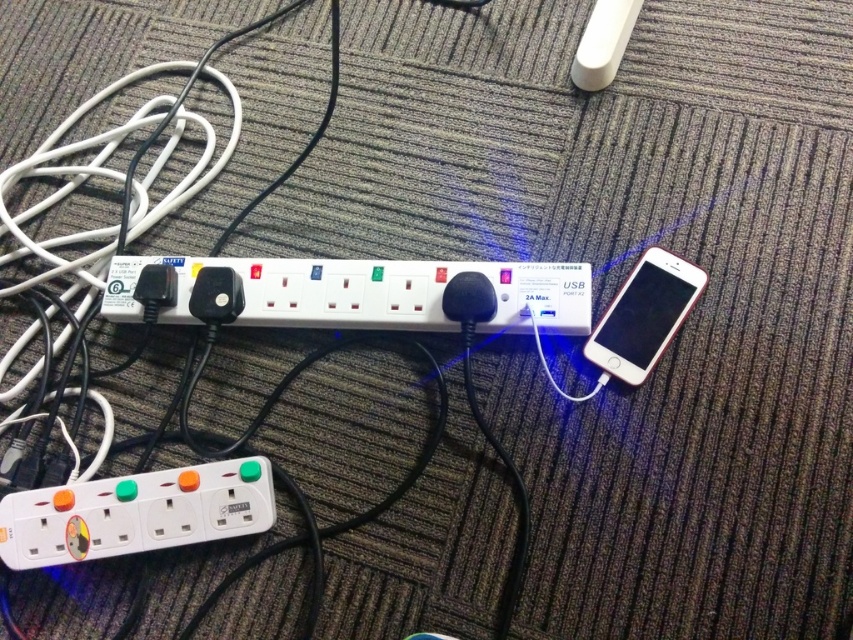
Consider the image. Does white plastic power strip at lower left have a lesser height compared to white glossy smartphone at right?

Correct, white plastic power strip at lower left is not as tall as white glossy smartphone at right.

Does point (119, 496) come closer to viewer compared to point (664, 269)?

Yes, it is.

Describe the element at coordinates (135, 513) in the screenshot. I see `white plastic power strip at lower left` at that location.

The width and height of the screenshot is (853, 640). I want to click on white plastic power strip at lower left, so click(x=135, y=513).

What do you see at coordinates (354, 292) in the screenshot?
I see `white plastic power strip at center` at bounding box center [354, 292].

Does point (329, 264) come closer to viewer compared to point (128, 497)?

No, it is behind (128, 497).

Locate an element on the screen. The width and height of the screenshot is (853, 640). white plastic power strip at center is located at coordinates (354, 292).

Is point (448, 264) less distant than point (593, 332)?

No.

Which of these two, white plastic power strip at center or white glossy smartphone at right, stands shorter?

With less height is white plastic power strip at center.

Locate an element on the screen. white plastic power strip at center is located at coordinates (354, 292).